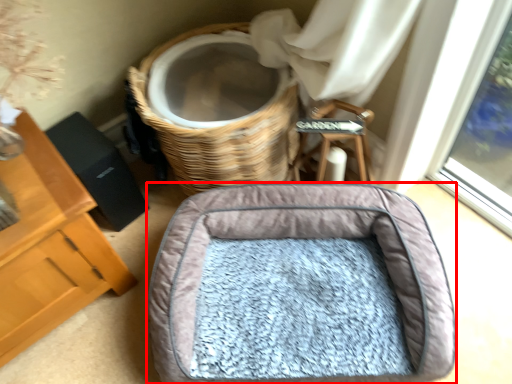
Question: Where is dog bed (annotated by the red box) located in relation to basket in the image?

Choices:
 (A) right
 (B) left

Answer: (A)